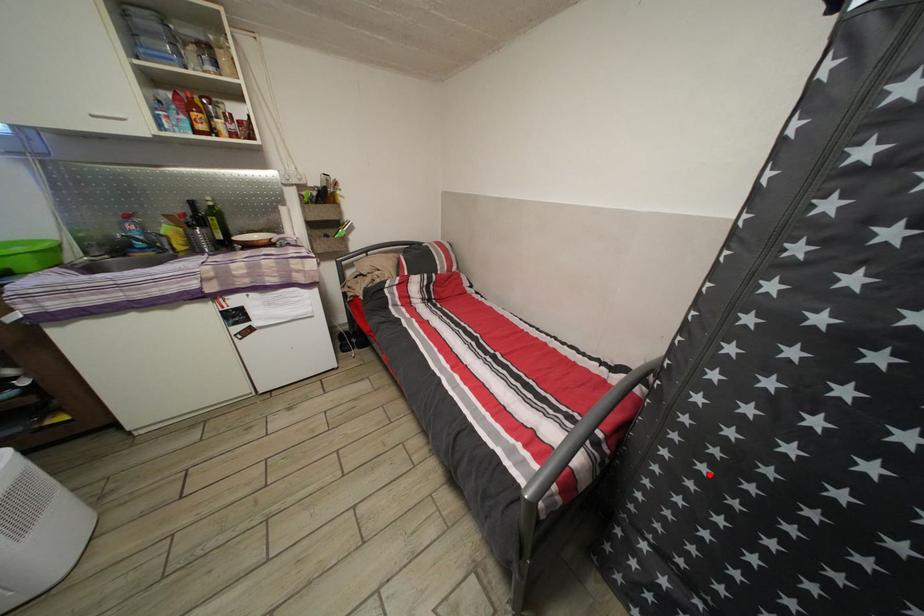
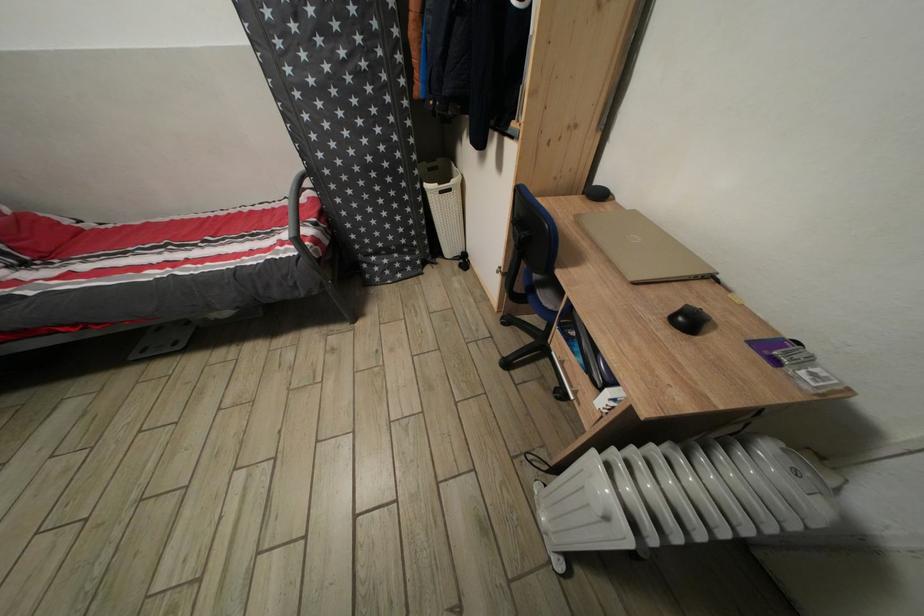
Question: I am providing you with two images of the same scene from different viewpoints. Given a red point in image1, look at the same physical point in image2. Is it:

Choices:
 (A) Closer to the viewpoint
 (B) Farther from the viewpoint

Answer: (A)